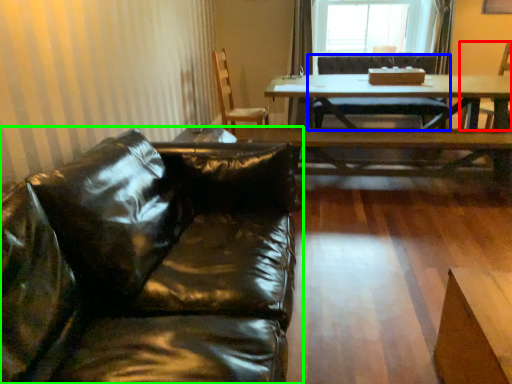
Question: Based on their relative distances, which object is nearer to armchair (highlighted by a red box)? Choose from chair (highlighted by a blue box) and studio couch (highlighted by a green box).

Choices:
 (A) chair
 (B) studio couch

Answer: (A)